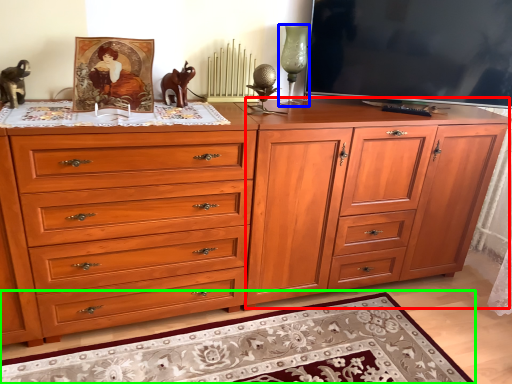
Question: Estimate the real-world distances between objects in this image. Which object is farther from file cabinet (highlighted by a red box), candle holder (highlighted by a blue box) or mat (highlighted by a green box)?

Choices:
 (A) candle holder
 (B) mat

Answer: (A)